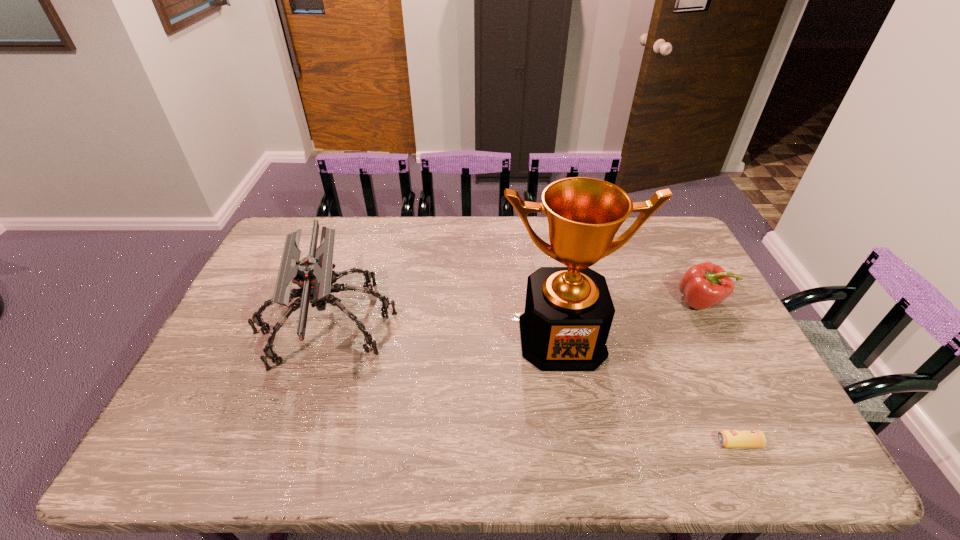
This screenshot has height=540, width=960. In order to click on free spot between the nearest object and the second tallest object in this screenshot , I will do `click(533, 383)`.

Locate an element on the screen. unoccupied position between the nearest object and the pepper is located at coordinates (719, 373).

Where is `vacant space that's between the tallest object and the second shortest object`? The image size is (960, 540). vacant space that's between the tallest object and the second shortest object is located at coordinates (631, 320).

You are a GUI agent. You are given a task and a screenshot of the screen. Output one action in this format:
    pyautogui.click(x=<x>, y=<y>)
    Task: Click on the vacant space that is in between the third tallest object and the trophy cup
    The width and height of the screenshot is (960, 540).
    Given the screenshot: What is the action you would take?
    pyautogui.click(x=631, y=320)

Identify the location of vacant region between the third tallest object and the drone. (514, 312).

I want to click on unoccupied position between the third tallest object and the shortest object, so click(x=719, y=373).

Find the location of a particular element. unoccupied position between the trophy cup and the third shortest object is located at coordinates (444, 330).

In order to click on vacant space that is in between the nearest object and the pepper in this screenshot , I will do `click(719, 373)`.

The image size is (960, 540). Identify the location of empty space that is in between the second object from left to right and the leftmost object. (444, 330).

Where is `vacant area that lies between the second shortest object and the drone`? This screenshot has height=540, width=960. vacant area that lies between the second shortest object and the drone is located at coordinates (514, 312).